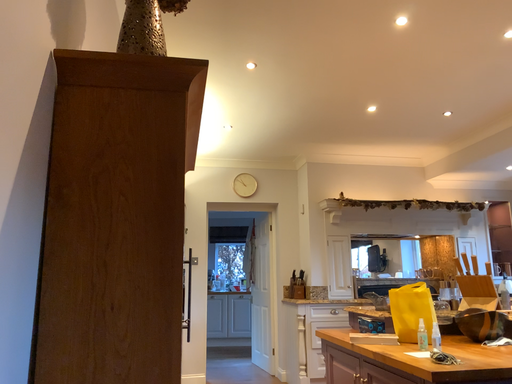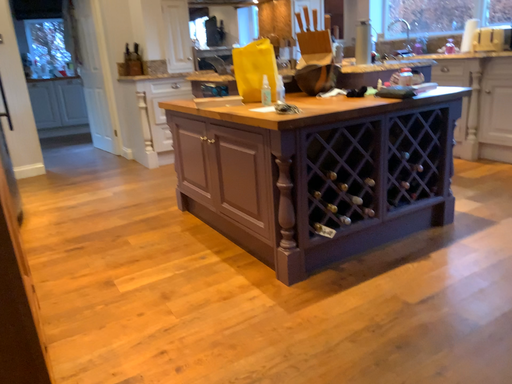
Question: Which way did the camera rotate in the video?

Choices:
 (A) rotated left
 (B) rotated right

Answer: (B)